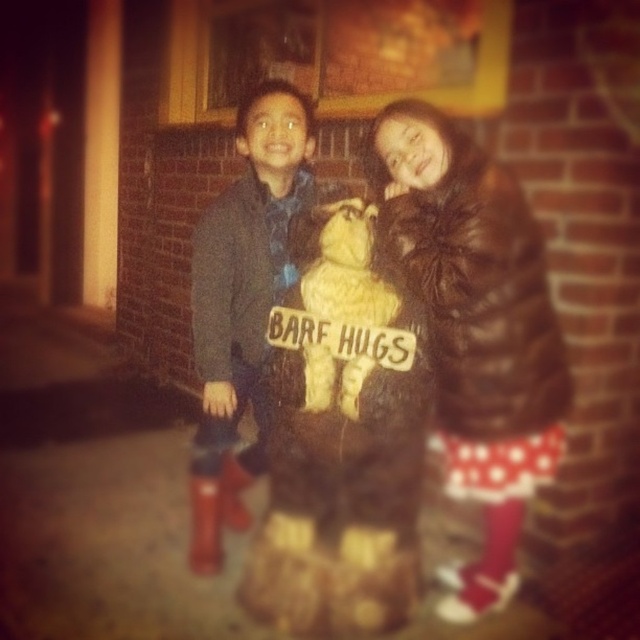
Question: Is fuzzy brown teddy bear at center further to camera compared to matte blue jacket at center?

Choices:
 (A) no
 (B) yes

Answer: (A)

Question: Can you confirm if fuzzy brown teddy bear at center is positioned above fuzzy beige stuffed bear at center?

Choices:
 (A) no
 (B) yes

Answer: (A)

Question: Which of these objects is positioned farthest from the matte blue jacket at center?

Choices:
 (A) fuzzy beige stuffed bear at center
 (B) fuzzy brown teddy bear at center

Answer: (A)

Question: Which object is closer to the camera taking this photo?

Choices:
 (A) matte blue jacket at center
 (B) fuzzy beige stuffed bear at center
 (C) fuzzy brown teddy bear at center

Answer: (C)

Question: Which of these objects is positioned farthest from the fuzzy brown teddy bear at center?

Choices:
 (A) matte blue jacket at center
 (B) fuzzy beige stuffed bear at center

Answer: (A)

Question: Is fuzzy brown teddy bear at center to the left of fuzzy beige stuffed bear at center from the viewer's perspective?

Choices:
 (A) yes
 (B) no

Answer: (A)